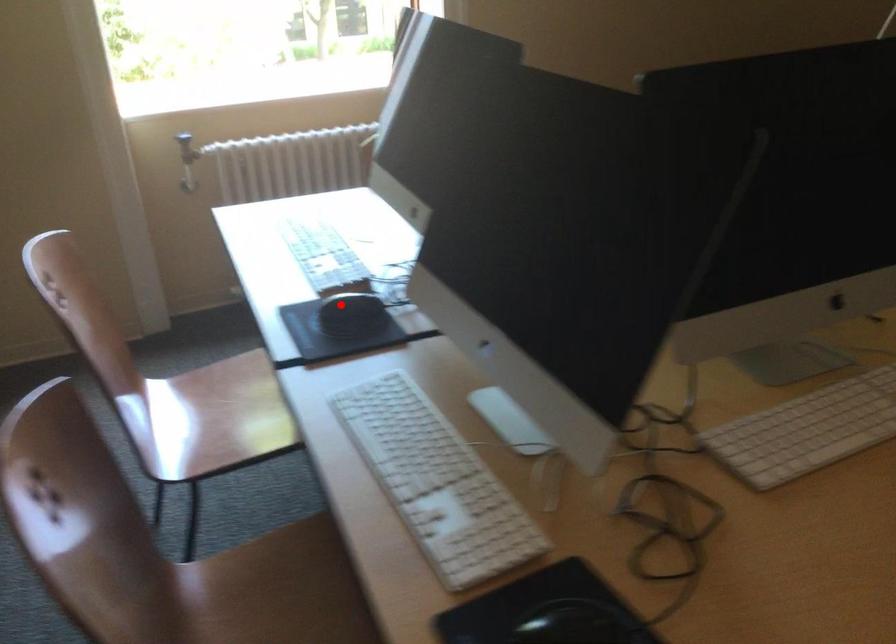
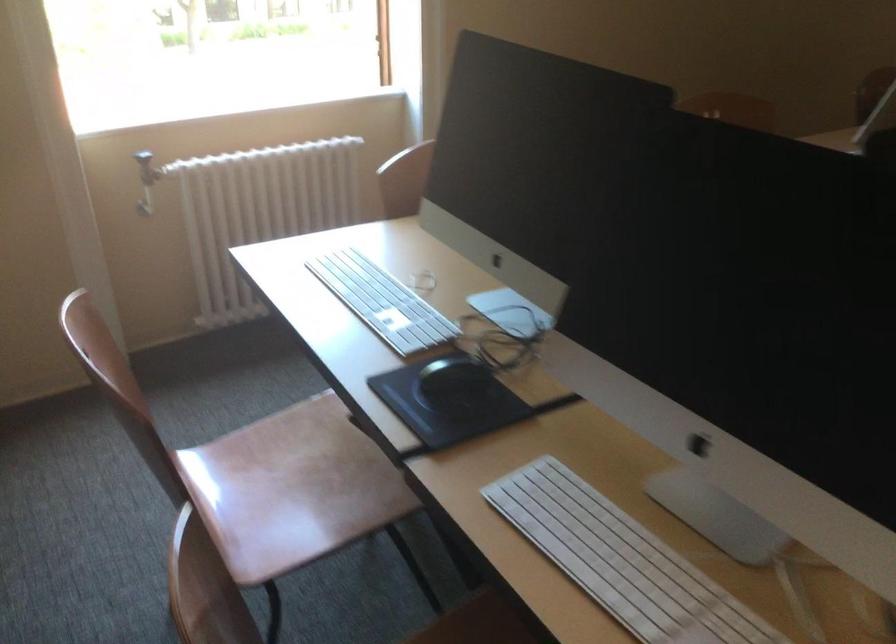
Question: I am providing you with two images of the same scene from different viewpoints. A red point is shown in image1. For the corresponding object point in image2, is it positioned nearer or farther from the camera?

Choices:
 (A) Nearer
 (B) Farther

Answer: (A)